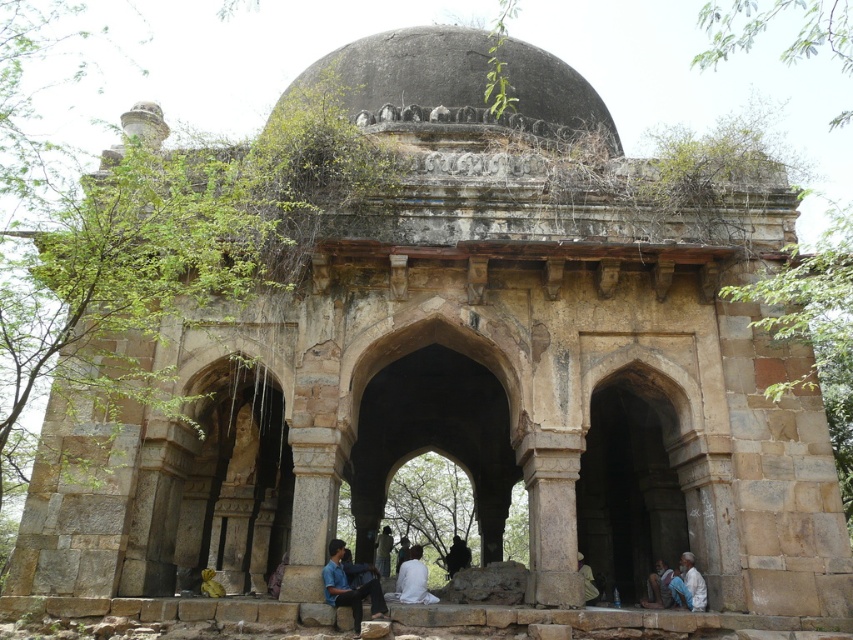
Question: Estimate the real-world distances between objects in this image. Which object is closer to the white fabric cloth at center?

Choices:
 (A) gray stone dome at center
 (B) dark brown leather jacket at center
 (C) green fabric cloth at lower center

Answer: (C)

Question: Which object is the closest to the light beige stone man at lower right?

Choices:
 (A) light brown fabric at lower center
 (B) blue shirt at lower center
 (C) gray stone dome at center

Answer: (A)

Question: Is white fabric cloth at center below light brown fabric at lower center?

Choices:
 (A) no
 (B) yes

Answer: (A)

Question: Considering the real-world distances, which object is farthest from the light beige stone man at lower right?

Choices:
 (A) blue shirt at lower center
 (B) dark brown leather jacket at center
 (C) white fabric cloth at center
 (D) green fabric cloth at lower center

Answer: (B)

Question: Can you confirm if gray stone dome at center is thinner than white fabric cloth at center?

Choices:
 (A) no
 (B) yes

Answer: (A)

Question: Considering the relative positions of light brown fabric at lower center and green fabric cloth at lower center in the image provided, where is light brown fabric at lower center located with respect to green fabric cloth at lower center?

Choices:
 (A) below
 (B) above

Answer: (A)